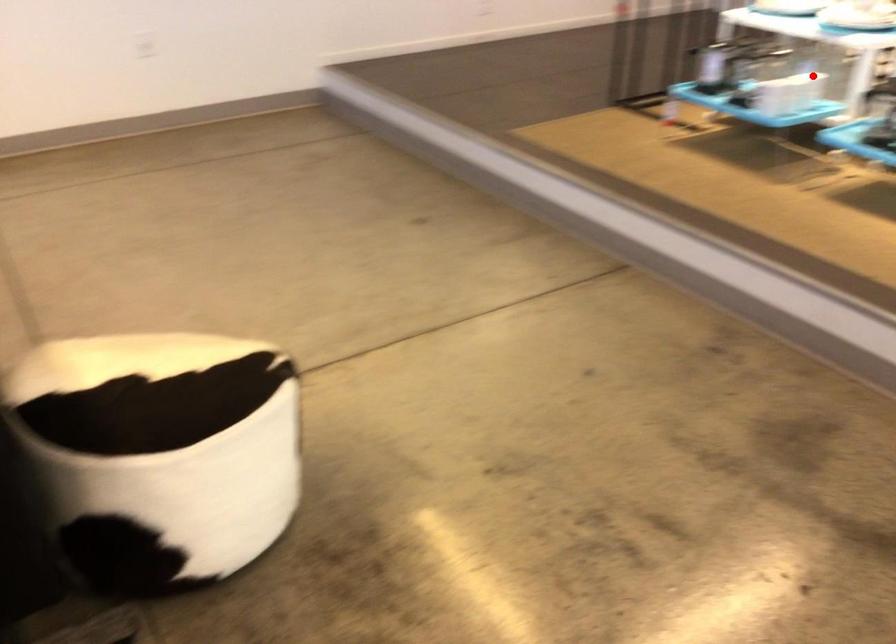
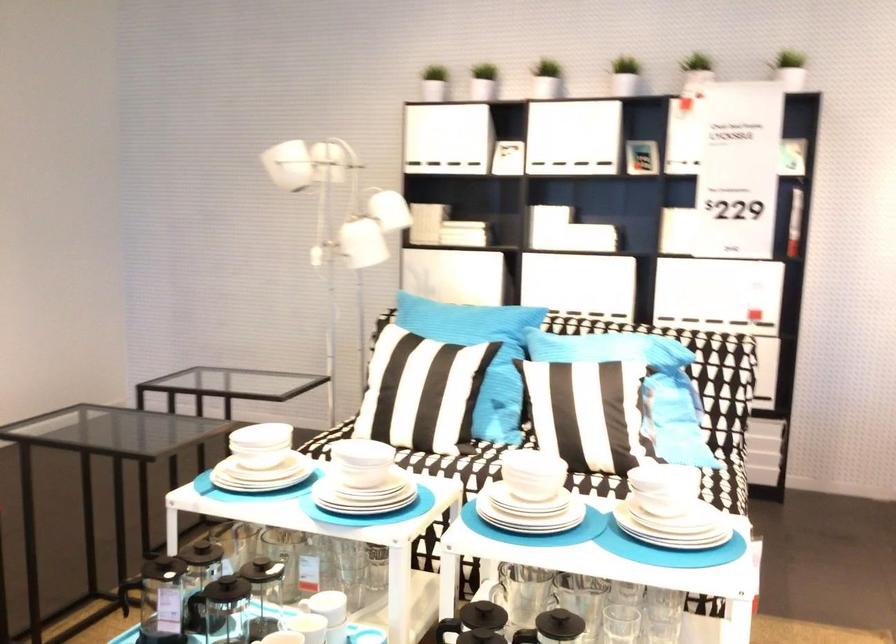
Find the pixel in the second image that matches the highlighted location in the first image.

(329, 605)